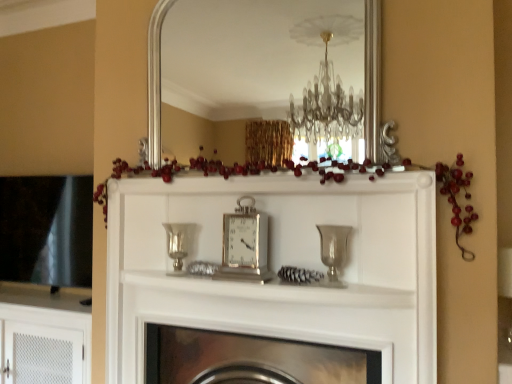
This screenshot has height=384, width=512. What are the coordinates of `silver/metallic clock at center` in the screenshot? It's located at (245, 245).

At what (x,y) coordinates should I click in order to perform the action: click on clear glass vase at center, positioned as the first candle holder in front-to-back order. Please return your answer as a coordinate pair (x, y). Image resolution: width=512 pixels, height=384 pixels. Looking at the image, I should click on (333, 251).

The height and width of the screenshot is (384, 512). I want to click on white textured cabinet at lower left, so click(44, 345).

This screenshot has width=512, height=384. What are the coordinates of `metallic silver fireplace at center` in the screenshot? It's located at (251, 359).

Is silver metallic vase at center, arranged as the 1th candle holder when viewed from the left, to the left of metallic silver fireplace at center from the viewer's perspective?

Yes, silver metallic vase at center, arranged as the 1th candle holder when viewed from the left, is to the left of metallic silver fireplace at center.

Is the surface of silver metallic vase at center, which is the second candle holder in right-to-left order, in direct contact with metallic silver fireplace at center?

No, silver metallic vase at center, which is the second candle holder in right-to-left order, is not touching metallic silver fireplace at center.

Is silver metallic vase at center, which is the second candle holder in right-to-left order, taller than metallic silver fireplace at center?

No, silver metallic vase at center, which is the second candle holder in right-to-left order, is not taller than metallic silver fireplace at center.

Looking at the image, does silver/metallic clock at center seem bigger or smaller compared to silver/metallic mirror at upper center?

Clearly, silver/metallic clock at center is smaller in size than silver/metallic mirror at upper center.

Between silver/metallic clock at center and silver/metallic mirror at upper center, which one appears on the left side from the viewer's perspective?

silver/metallic clock at center.

From the image's perspective, who appears lower, silver/metallic clock at center or silver/metallic mirror at upper center?

silver/metallic clock at center, from the image's perspective.

Can you confirm if silver/metallic clock at center is shorter than silver/metallic mirror at upper center?

Correct, silver/metallic clock at center is not as tall as silver/metallic mirror at upper center.

The height and width of the screenshot is (384, 512). Identify the location of clock below the silver/metallic mirror at upper center (from the image's perspective). (245, 245).

Considering the sizes of silver/metallic mirror at upper center and silver/metallic clock at center in the image, is silver/metallic mirror at upper center taller or shorter than silver/metallic clock at center?

In the image, silver/metallic mirror at upper center appears to be taller than silver/metallic clock at center.

In terms of width, does silver/metallic mirror at upper center look wider or thinner when compared to silver/metallic clock at center?

Clearly, silver/metallic mirror at upper center has less width compared to silver/metallic clock at center.

Can we say silver/metallic mirror at upper center lies outside silver/metallic clock at center?

That's correct, silver/metallic mirror at upper center is outside of silver/metallic clock at center.

From a real-world perspective, which is physically below, metallic silver fireplace at center or silver metallic vase at center, the 1th candle holder from the back?

metallic silver fireplace at center, from a real-world perspective.

Could you tell me if metallic silver fireplace at center is facing silver metallic vase at center, which is counted as the 2th candle holder, starting from the front?

No, metallic silver fireplace at center is not oriented towards silver metallic vase at center, which is counted as the 2th candle holder, starting from the front.

Is silver metallic vase at center, arranged as the 1th candle holder when viewed from the left, inside metallic silver fireplace at center?

No, metallic silver fireplace at center does not contain silver metallic vase at center, arranged as the 1th candle holder when viewed from the left.

Considering the sizes of metallic silver fireplace at center and silver metallic vase at center, which is the second candle holder in right-to-left order, in the image, is metallic silver fireplace at center taller or shorter than silver metallic vase at center, which is the second candle holder in right-to-left order,?

metallic silver fireplace at center is taller than silver metallic vase at center, which is the second candle holder in right-to-left order.

Could silver/metallic clock at center be considered to be inside silver metallic vase at center, the 1th candle holder from the back?

No, silver/metallic clock at center is not a part of silver metallic vase at center, the 1th candle holder from the back.

Between silver metallic vase at center, which is the second candle holder in right-to-left order, and silver/metallic clock at center, which one has less height?

silver metallic vase at center, which is the second candle holder in right-to-left order.

Is silver metallic vase at center, the 1th candle holder from the back, facing towards silver/metallic clock at center?

No, silver metallic vase at center, the 1th candle holder from the back, is not facing towards silver/metallic clock at center.

From a real-world perspective, is silver metallic vase at center, arranged as the 1th candle holder when viewed from the left, beneath silver/metallic clock at center?

Yes, from a real-world perspective, silver metallic vase at center, arranged as the 1th candle holder when viewed from the left, is under silver/metallic clock at center.

In terms of size, does clear glass vase at center, positioned as the first candle holder in front-to-back order, appear bigger or smaller than white textured cabinet at lower left?

clear glass vase at center, positioned as the first candle holder in front-to-back order, is smaller than white textured cabinet at lower left.

From the white textured cabinet at lower left, count 2nd candle holder to the right and point to it. Please provide its 2D coordinates.

[(333, 251)]

Is clear glass vase at center, placed as the second candle holder when sorted from back to front, positioned before white textured cabinet at lower left?

Yes.

Could you tell me if white textured cabinet at lower left is turned towards silver/metallic clock at center?

No, white textured cabinet at lower left is not turned towards silver/metallic clock at center.

Which is more to the left, white textured cabinet at lower left or silver/metallic clock at center?

From the viewer's perspective, white textured cabinet at lower left appears more on the left side.

Can we say white textured cabinet at lower left lies outside silver/metallic clock at center?

Yes, white textured cabinet at lower left is outside of silver/metallic clock at center.

Where is `candle holder to the left of metallic silver fireplace at center`? candle holder to the left of metallic silver fireplace at center is located at coordinates (178, 244).

Locate an element on the screen. The height and width of the screenshot is (384, 512). clock below the silver/metallic mirror at upper center (from the image's perspective) is located at coordinates (245, 245).

When comparing their distances from white textured cabinet at lower left, does metallic silver fireplace at center or silver/metallic clock at center seem closer?

Among the two, metallic silver fireplace at center is located nearer to white textured cabinet at lower left.

From the image, which object appears to be farther from silver/metallic mirror at upper center, metallic silver fireplace at center or clear glass vase at center, placed as the first candle holder when sorted from right to left?

metallic silver fireplace at center is positioned further to the anchor silver/metallic mirror at upper center.

When comparing their distances from silver/metallic clock at center, does metallic silver fireplace at center or clear glass vase at center, which is the 2th candle holder in left-to-right order, seem further?

The object further to silver/metallic clock at center is metallic silver fireplace at center.

Looking at the image, which one is located closer to white textured cabinet at lower left, clear glass vase at center, which is the 2th candle holder in left-to-right order, or metallic silver fireplace at center?

metallic silver fireplace at center.

Based on their spatial positions, is silver/metallic clock at center or silver metallic vase at center, which is counted as the 2th candle holder, starting from the front, closer to metallic silver fireplace at center?

silver/metallic clock at center.

Considering their positions, is metallic silver fireplace at center positioned further to white textured cabinet at lower left than clear glass vase at center, placed as the second candle holder when sorted from back to front?

clear glass vase at center, placed as the second candle holder when sorted from back to front, is further to white textured cabinet at lower left.

Looking at the image, which one is located closer to clear glass vase at center, which is the 2th candle holder in left-to-right order, white textured cabinet at lower left or metallic silver fireplace at center?

metallic silver fireplace at center lies closer to clear glass vase at center, which is the 2th candle holder in left-to-right order, than the other object.

Considering their positions, is clear glass vase at center, placed as the first candle holder when sorted from right to left, positioned further to metallic silver fireplace at center than white textured cabinet at lower left?

The object further to metallic silver fireplace at center is white textured cabinet at lower left.

Where is `candle holder between silver/metallic mirror at upper center and clear glass vase at center, placed as the second candle holder when sorted from back to front, in the vertical direction`? candle holder between silver/metallic mirror at upper center and clear glass vase at center, placed as the second candle holder when sorted from back to front, in the vertical direction is located at coordinates click(178, 244).

Where is `clock between silver/metallic mirror at upper center and clear glass vase at center, placed as the second candle holder when sorted from back to front, from top to bottom`? clock between silver/metallic mirror at upper center and clear glass vase at center, placed as the second candle holder when sorted from back to front, from top to bottom is located at coordinates (245, 245).

The width and height of the screenshot is (512, 384). I want to click on clock between silver/metallic mirror at upper center and silver metallic vase at center, which is counted as the 2th candle holder, starting from the front, in the vertical direction, so click(245, 245).

Identify the location of fireplace between white textured cabinet at lower left and clear glass vase at center, positioned as the first candle holder in front-to-back order, from left to right. (251, 359).